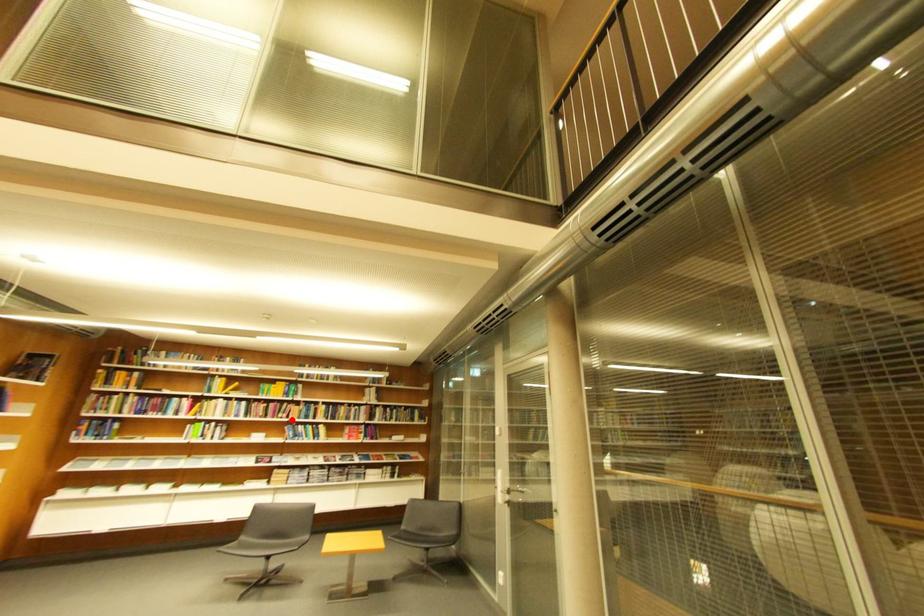
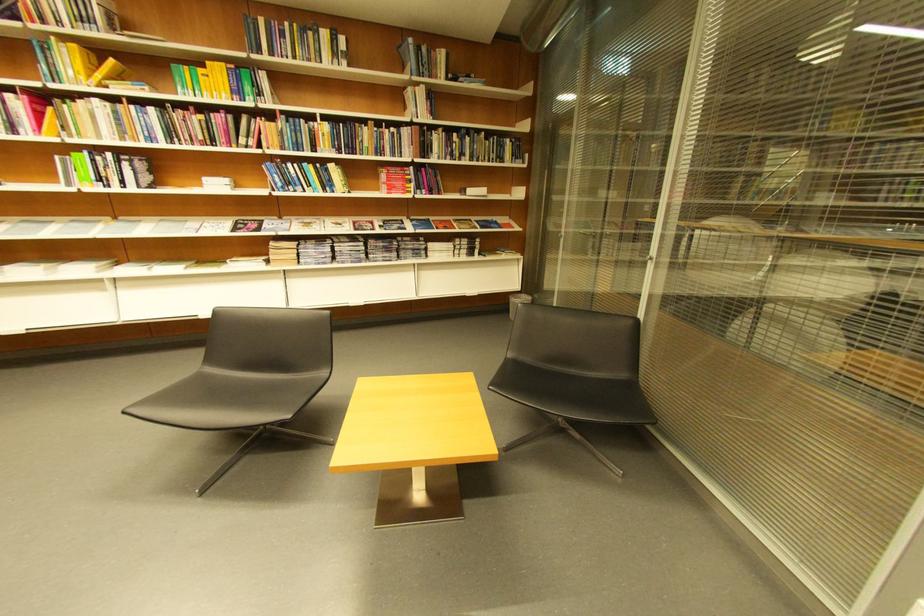
Locate, in the second image, the point that corresponds to the highlighted location in the first image.

(258, 148)